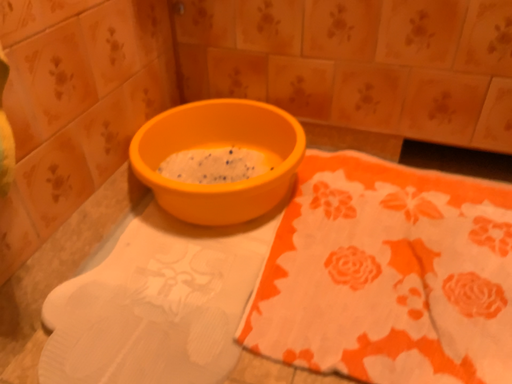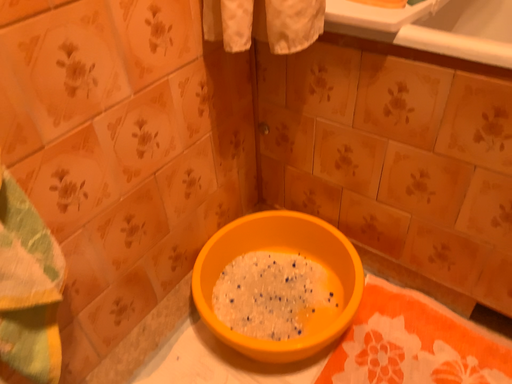
Question: How did the camera likely rotate when shooting the video?

Choices:
 (A) rotated right
 (B) rotated left

Answer: (B)